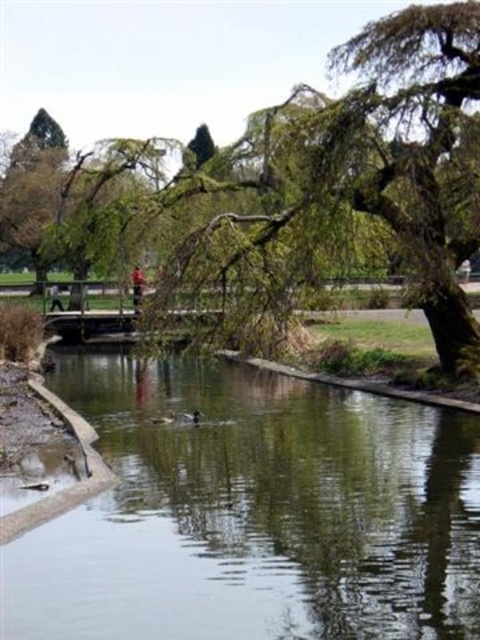
Question: Is clear water at center above green leafy tree at center?

Choices:
 (A) yes
 (B) no

Answer: (B)

Question: Among these points, which one is farthest from the camera?

Choices:
 (A) (443, 88)
 (B) (456, 538)

Answer: (A)

Question: Which point is farther to the camera?

Choices:
 (A) green leafy tree at center
 (B) clear water at center

Answer: (A)

Question: Does clear water at center appear on the right side of green leafy tree at center?

Choices:
 (A) yes
 (B) no

Answer: (A)

Question: Does clear water at center come in front of green leafy tree at center?

Choices:
 (A) yes
 (B) no

Answer: (A)